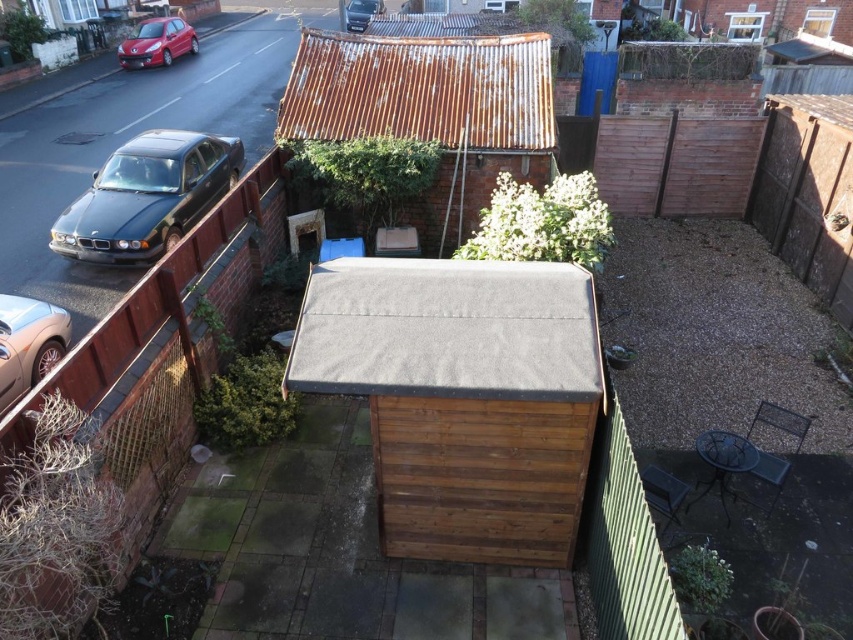
Can you confirm if brown wooden shed at center is positioned below metallic gold car at left?

Yes.

Is brown wooden shed at center positioned at the back of metallic gold car at left?

That is False.

Measure the distance between brown wooden shed at center and camera.

brown wooden shed at center and camera are 16.48 feet apart.

Locate an element on the screen. brown wooden shed at center is located at coordinates (462, 397).

Is brown wooden shed at center shorter than shiny red car at upper left?

No, brown wooden shed at center is not shorter than shiny red car at upper left.

Is brown wooden shed at center wider than shiny red car at upper left?

Indeed, brown wooden shed at center has a greater width compared to shiny red car at upper left.

From the picture: Who is more forward, (515, 452) or (141, 35)?

Point (515, 452)

The image size is (853, 640). I want to click on brown wooden shed at center, so click(462, 397).

The height and width of the screenshot is (640, 853). I want to click on matte black car at left, so click(x=148, y=195).

Does matte black car at left have a greater width compared to metallic gold car at left?

Yes.

I want to click on matte black car at left, so click(148, 195).